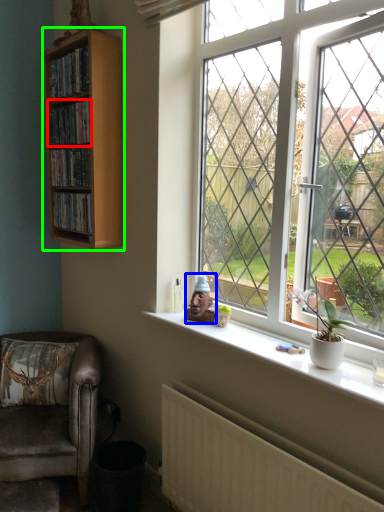
Question: Estimate the real-world distances between objects in this image. Which object is closer to book (highlighted by a red box), toy (highlighted by a blue box) or bookcase (highlighted by a green box)?

Choices:
 (A) toy
 (B) bookcase

Answer: (B)